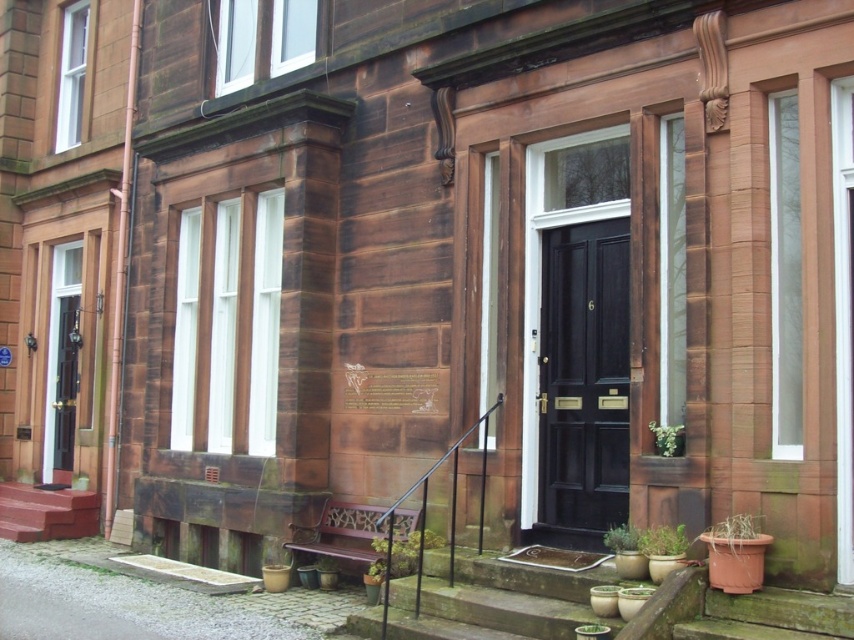
You are a delivery person holding a large package that requires you to go through the black glossy door at center. However, you notice the smooth red stairs at lower left nearby. Considering their sizes, can the package fit through the door without needing to be disassembled?

The black glossy door at center has a smaller size compared to smooth red stairs at lower left. Since the door is smaller, the package may not fit through it without being disassembled.

You are standing in front of a historical building with a reddish brown stone facade. You need to locate the black glossy door at center. Based on its 2D coordinates, can you tell me whether it is positioned to the left or right side of the building?

The black glossy door at center is positioned at the center of the building since its 2D coordinates are at point (583, 381), which is close to the central point of the image.

You are standing in front of a historical building with a reddish brown stone facade. You see a point marked at coordinate (583, 381). What object is located at this coordinate?

The point at coordinate (583, 381) marks the location of the black glossy door at center.